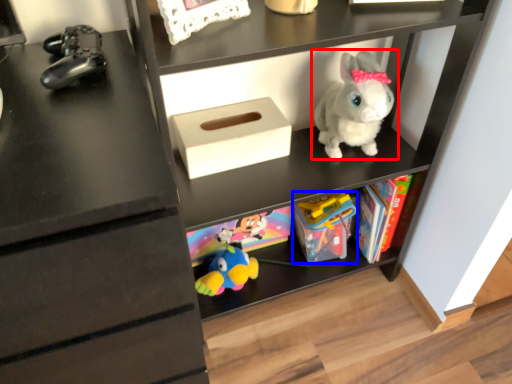
Question: Which object is closer to the camera taking this photo, toy (highlighted by a red box) or toy (highlighted by a blue box)?

Choices:
 (A) toy
 (B) toy

Answer: (A)